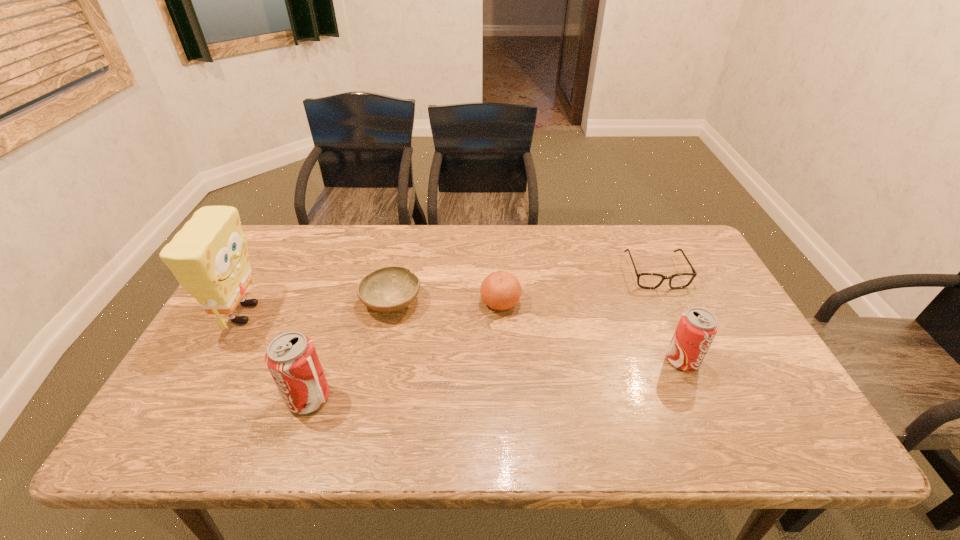
If equal spacing is desired by inserting an extra pop_(soda) among them, please point out a free spot for this new pop_(soda). Please provide its 2D coordinates. Your answer should be formatted as a tuple, i.e. [(x, y)], where the tuple contains the x and y coordinates of a point satisfying the conditions above.

[(503, 379)]